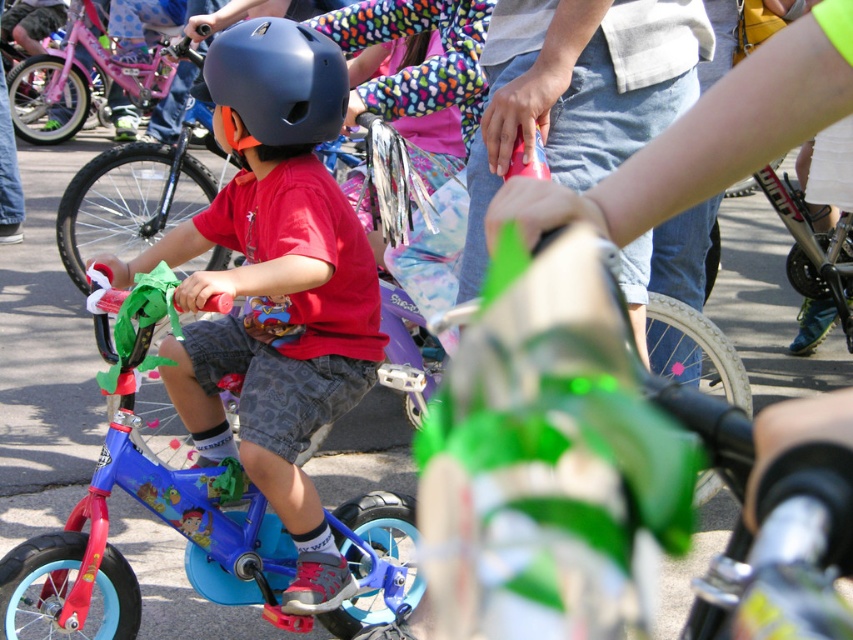
Which is below, blue plastic bicycle at center or pink matte bicycle at left?

Positioned lower is blue plastic bicycle at center.

Can you confirm if blue plastic bicycle at center is positioned below pink matte bicycle at left?

Correct, blue plastic bicycle at center is located below pink matte bicycle at left.

Does point (73, 525) lie behind point (20, 113)?

No, it is in front of (20, 113).

You are a GUI agent. You are given a task and a screenshot of the screen. Output one action in this format:
    pyautogui.click(x=<x>, y=<y>)
    Task: Click on the blue plastic bicycle at center
    Image resolution: width=853 pixels, height=640 pixels.
    Given the screenshot: What is the action you would take?
    pyautogui.click(x=157, y=515)

Can you confirm if matte blue helmet at center is smaller than pink matte bicycle at left?

Indeed, matte blue helmet at center has a smaller size compared to pink matte bicycle at left.

Is matte blue helmet at center above pink matte bicycle at left?

Actually, matte blue helmet at center is below pink matte bicycle at left.

Is point (361, 305) more distant than point (70, 70)?

No.

Where is `matte blue helmet at center`? matte blue helmet at center is located at coordinates (276, 285).

Is denim jeans at center further to the viewer compared to matte black helmet at center?

No, it is not.

Looking at this image, who is more forward, (x=666, y=32) or (x=281, y=124)?

Point (x=666, y=32) is in front.

Find the location of `denim jeans at center`. denim jeans at center is located at coordinates (578, 92).